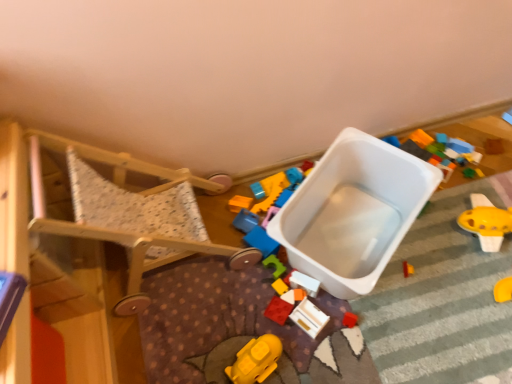
At what (x,y) coordinates should I click in order to perform the action: click on free point to the right of yellow matte toy at lower center, placed as the 6th toy when sorted from right to left. Please return your answer as a coordinate pair (x, y). This screenshot has height=384, width=512. Looking at the image, I should click on (316, 349).